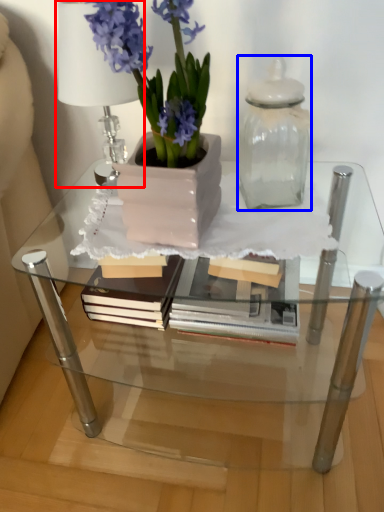
Question: Which object is closer to the camera taking this photo, table lamp (highlighted by a red box) or glass vase (highlighted by a blue box)?

Choices:
 (A) table lamp
 (B) glass vase

Answer: (B)